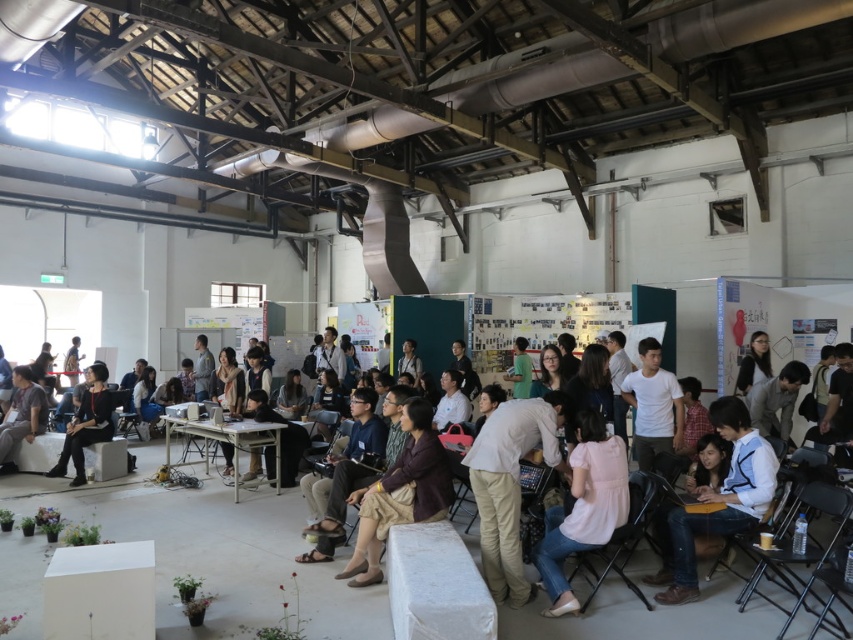
Does matte black jacket at center lie behind gray fabric shirt at lower left?

No, it is not.

Is point (152, 492) farther from viewer compared to point (18, 384)?

That is False.

I want to click on matte black jacket at center, so click(x=189, y=550).

Is dark purple fabric dress at center smaller than metallic gray table at center?

Correct, dark purple fabric dress at center occupies less space than metallic gray table at center.

Which is below, dark purple fabric dress at center or metallic gray table at center?

metallic gray table at center is lower down.

Is point (386, 525) positioned after point (234, 440)?

No, it is not.

You are a GUI agent. You are given a task and a screenshot of the screen. Output one action in this format:
    pyautogui.click(x=<x>, y=<y>)
    Task: Click on the dark purple fabric dress at center
    Image resolution: width=853 pixels, height=640 pixels.
    Given the screenshot: What is the action you would take?
    pyautogui.click(x=399, y=493)

Is matte black jacket at center wider than metallic gray table at center?

Yes.

Is matte black jacket at center in front of metallic gray table at center?

That is True.

You are a GUI agent. You are given a task and a screenshot of the screen. Output one action in this format:
    pyautogui.click(x=<x>, y=<y>)
    Task: Click on the matte black jacket at center
    
    Given the screenshot: What is the action you would take?
    pos(189,550)